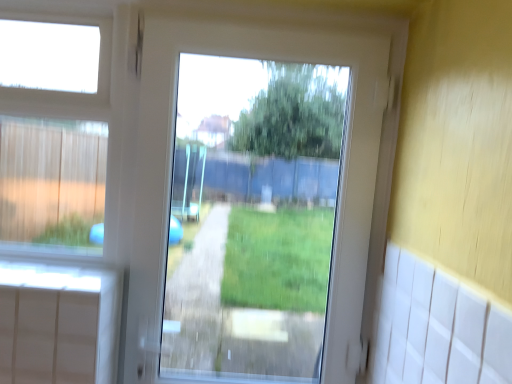
The image size is (512, 384). Identify the location of white plastic window at upper left. (54, 132).

The image size is (512, 384). What do you see at coordinates (54, 132) in the screenshot?
I see `white plastic window at upper left` at bounding box center [54, 132].

Find the location of a particular element. Image resolution: width=512 pixels, height=384 pixels. white plastic screen door at center is located at coordinates (341, 177).

Describe the element at coordinates (341, 177) in the screenshot. I see `white plastic screen door at center` at that location.

Where is `white plastic window at upper left`? This screenshot has width=512, height=384. white plastic window at upper left is located at coordinates (54, 132).

Is white plastic screen door at center at the left side of white plastic window at upper left?

No.

Between white plastic screen door at center and white plastic window at upper left, which one is positioned in front?

white plastic screen door at center is more forward.

Does point (148, 352) lie in front of point (37, 125)?

No, (148, 352) is further to viewer.

From the image's perspective, is white plastic screen door at center located beneath white plastic window at upper left?

Indeed, from the image's perspective, white plastic screen door at center is shown beneath white plastic window at upper left.

From a real-world perspective, which is physically above, white plastic screen door at center or white plastic window at upper left?

white plastic window at upper left, from a real-world perspective.

Considering the relative sizes of white plastic screen door at center and white plastic window at upper left in the image provided, is white plastic screen door at center thinner than white plastic window at upper left?

In fact, white plastic screen door at center might be wider than white plastic window at upper left.

Considering the sizes of objects white plastic screen door at center and white plastic window at upper left in the image provided, who is shorter, white plastic screen door at center or white plastic window at upper left?

white plastic window at upper left.

Considering the relative sizes of white plastic screen door at center and white plastic window at upper left in the image provided, is white plastic screen door at center bigger than white plastic window at upper left?

Correct, white plastic screen door at center is larger in size than white plastic window at upper left.

Is white plastic window at upper left a part of white plastic screen door at center?

No, white plastic window at upper left is not a part of white plastic screen door at center.

Is white plastic screen door at center in contact with white plastic window at upper left?

No, white plastic screen door at center is not making contact with white plastic window at upper left.

Is white plastic screen door at center looking in the opposite direction of white plastic window at upper left?

No, white plastic screen door at center's orientation is not away from white plastic window at upper left.

Measure the distance between white plastic screen door at center and white plastic window at upper left.

The distance of white plastic screen door at center from white plastic window at upper left is 14.23 inches.

Where is `bay window to the left of white plastic screen door at center`? The width and height of the screenshot is (512, 384). bay window to the left of white plastic screen door at center is located at coordinates coord(54,132).

Does white plastic window at upper left appear on the right side of white plastic screen door at center?

No, white plastic window at upper left is not to the right of white plastic screen door at center.

Is white plastic window at upper left in front of white plastic screen door at center?

No.

Does point (36, 43) lie in front of point (354, 40)?

No, (36, 43) is further to viewer.

From the image's perspective, is white plastic window at upper left located beneath white plastic screen door at center?

Incorrect, from the image's perspective, white plastic window at upper left is higher than white plastic screen door at center.

From a real-world perspective, between white plastic window at upper left and white plastic screen door at center, who is vertically lower?

white plastic screen door at center is physically lower.

Considering the relative sizes of white plastic window at upper left and white plastic screen door at center in the image provided, is white plastic window at upper left wider than white plastic screen door at center?

In fact, white plastic window at upper left might be narrower than white plastic screen door at center.

Is white plastic window at upper left taller than white plastic screen door at center?

No, white plastic window at upper left is not taller than white plastic screen door at center.

Considering the relative sizes of white plastic window at upper left and white plastic screen door at center in the image provided, is white plastic window at upper left smaller than white plastic screen door at center?

Correct, white plastic window at upper left occupies less space than white plastic screen door at center.

Would you say white plastic window at upper left contains white plastic screen door at center?

No, white plastic screen door at center is located outside of white plastic window at upper left.

Is white plastic window at upper left far away from white plastic screen door at center?

No.

Is white plastic window at upper left positioned with its back to white plastic screen door at center?

white plastic window at upper left is not turned away from white plastic screen door at center.

What's the angular difference between white plastic window at upper left and white plastic screen door at center's facing directions?

white plastic window at upper left and white plastic screen door at center are facing 1.12 degrees away from each other.

You are a GUI agent. You are given a task and a screenshot of the screen. Output one action in this format:
    pyautogui.click(x=<x>, y=<y>)
    Task: Click on the screen door in front of the white plastic window at upper left
    The width and height of the screenshot is (512, 384).
    Given the screenshot: What is the action you would take?
    pyautogui.click(x=341, y=177)

The height and width of the screenshot is (384, 512). I want to click on screen door below the white plastic window at upper left (from a real-world perspective), so click(341, 177).

The height and width of the screenshot is (384, 512). I want to click on screen door on the right of white plastic window at upper left, so click(341, 177).